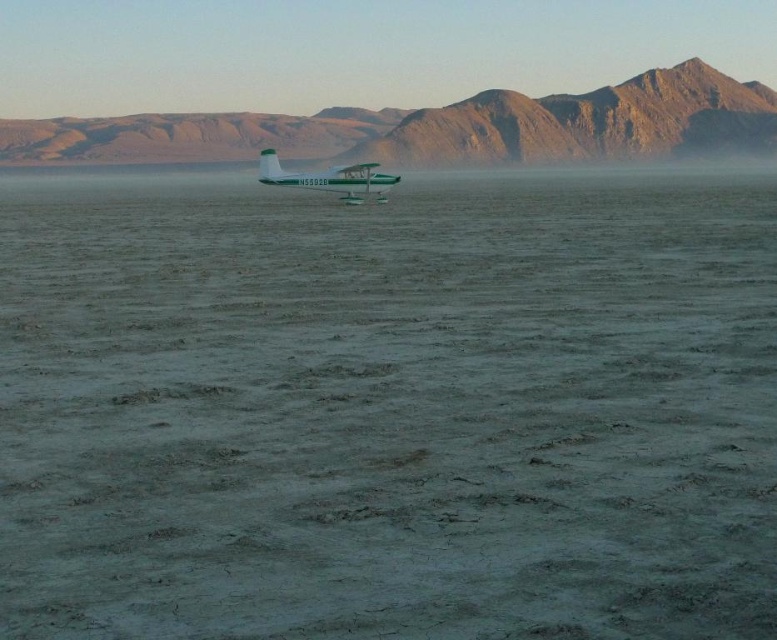
Who is shorter, gray matte sand at center or rugged brown mountain at center?

With less height is gray matte sand at center.

Between gray matte sand at center and rugged brown mountain at center, which one is positioned lower?

Positioned lower is gray matte sand at center.

The image size is (777, 640). Find the location of `gray matte sand at center`. gray matte sand at center is located at coordinates (389, 408).

Between rugged brown mountain at center and green matte seaplane at center, which one is positioned lower?

green matte seaplane at center is lower down.

How far apart are rugged brown mountain at center and green matte seaplane at center?

A distance of 420.81 feet exists between rugged brown mountain at center and green matte seaplane at center.

This screenshot has width=777, height=640. What do you see at coordinates (427, 125) in the screenshot?
I see `rugged brown mountain at center` at bounding box center [427, 125].

Identify the location of rugged brown mountain at center. This screenshot has width=777, height=640. (427, 125).

Which is in front, point (671, 243) or point (288, 182)?

Point (671, 243) is more forward.

Between point (68, 596) and point (361, 179), which one is positioned behind?

The point (361, 179) is behind.

Does point (326, 204) come behind point (370, 168)?

Yes, it is behind point (370, 168).

This screenshot has height=640, width=777. Identify the location of gray matte sand at center. 389,408.